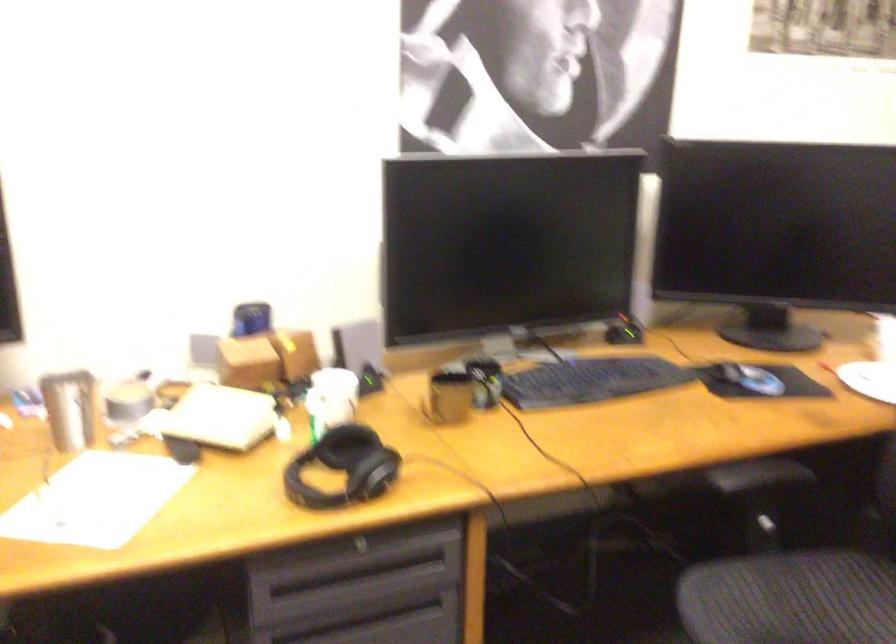
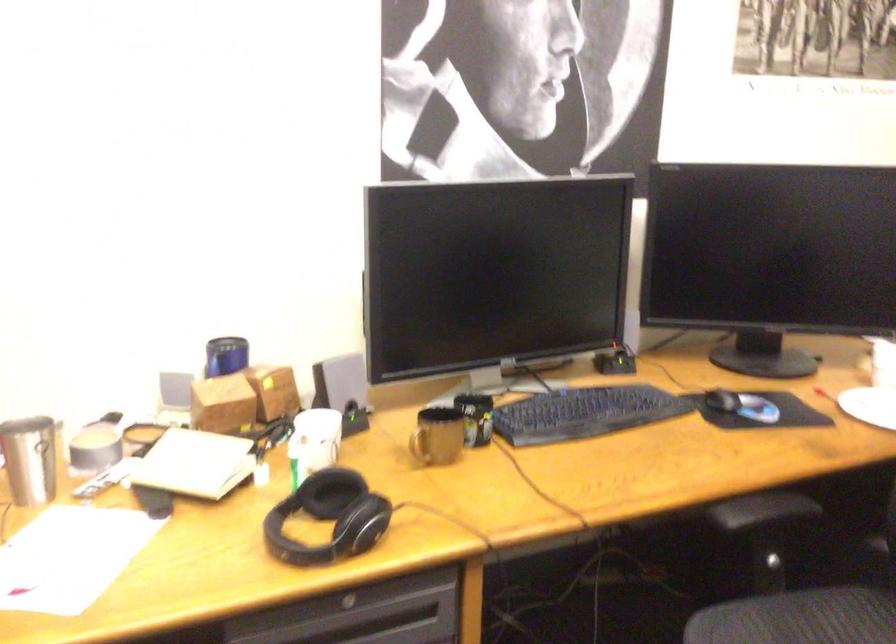
Where in the second image is the point corresponding to point (428, 402) from the first image?

(419, 442)